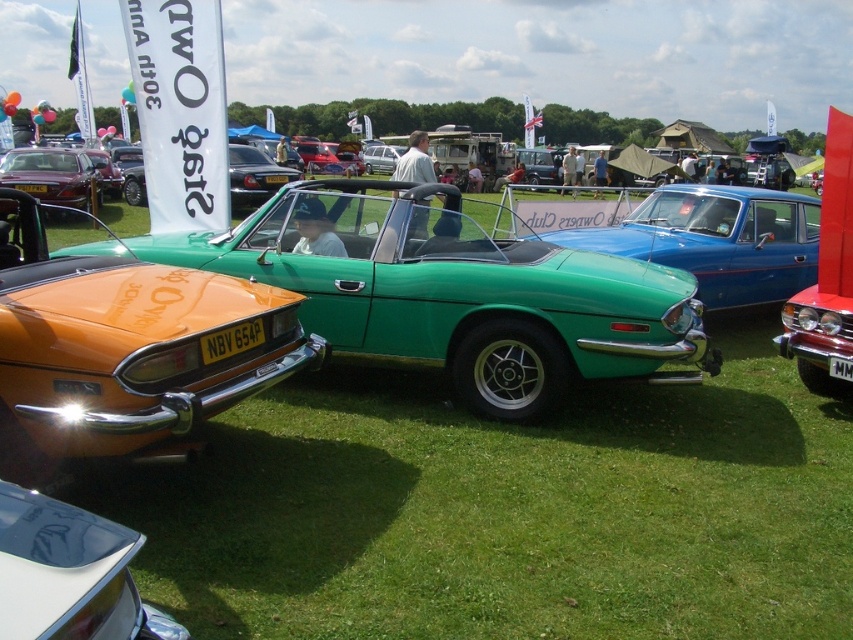
Question: Which is farther from the orange metallic car at left?

Choices:
 (A) orange metallic sports car at left
 (B) green grass at center

Answer: (B)

Question: Which object is positioned closest to the orange metallic car at left?

Choices:
 (A) shiny silver car at lower left
 (B) shiny black convertible at center

Answer: (A)

Question: From the image, what is the correct spatial relationship of green grass at center in relation to shiny black convertible at center?

Choices:
 (A) above
 (B) below

Answer: (B)

Question: Where is green grass at center located in relation to matte orange car at left in the image?

Choices:
 (A) right
 (B) left

Answer: (A)

Question: Estimate the real-world distances between objects in this image. Which object is farther from the green glossy convertible at center?

Choices:
 (A) shiny black convertible at center
 (B) green grass at center
 (C) matte orange car at left
 (D) shiny silver car at lower left

Answer: (C)

Question: Does orange metallic car at left have a larger size compared to orange metallic sports car at left?

Choices:
 (A) yes
 (B) no

Answer: (A)